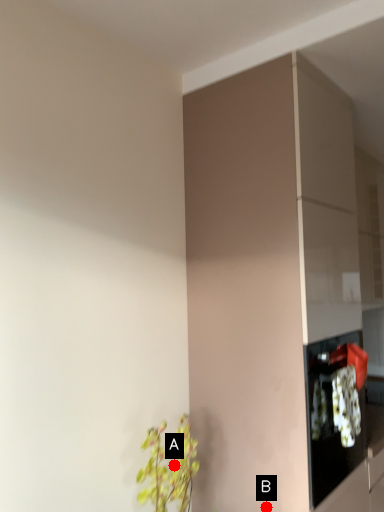
Question: Two points are circled on the image, labeled by A and B beside each circle. Which point is closer to the camera?

Choices:
 (A) A is closer
 (B) B is closer

Answer: (A)